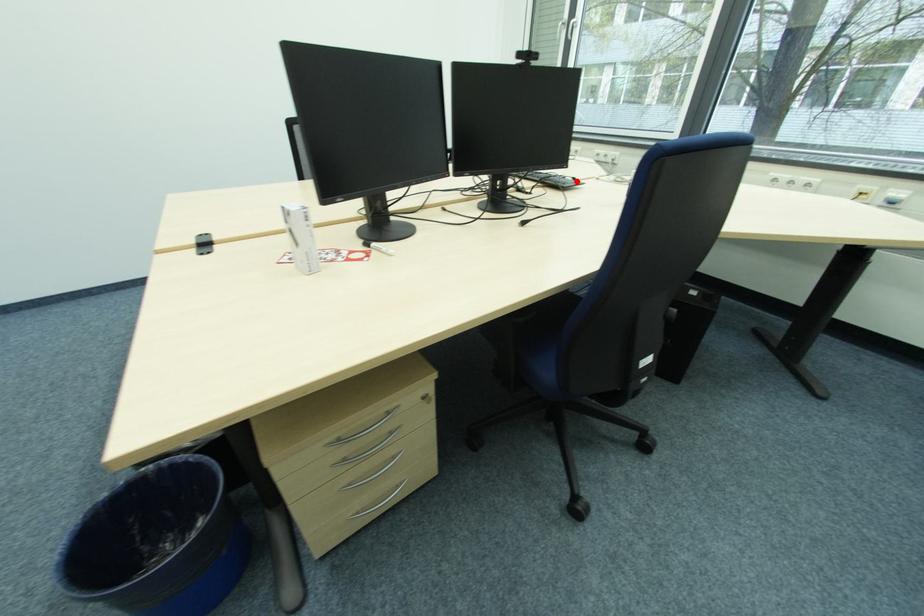
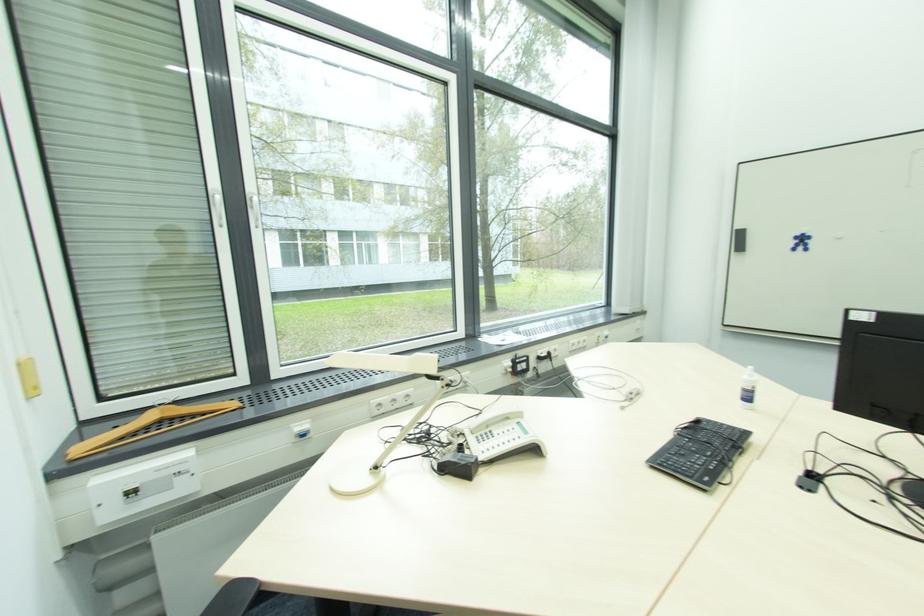
Find the pixel in the second image that matches the highlighted location in the first image.

(700, 424)